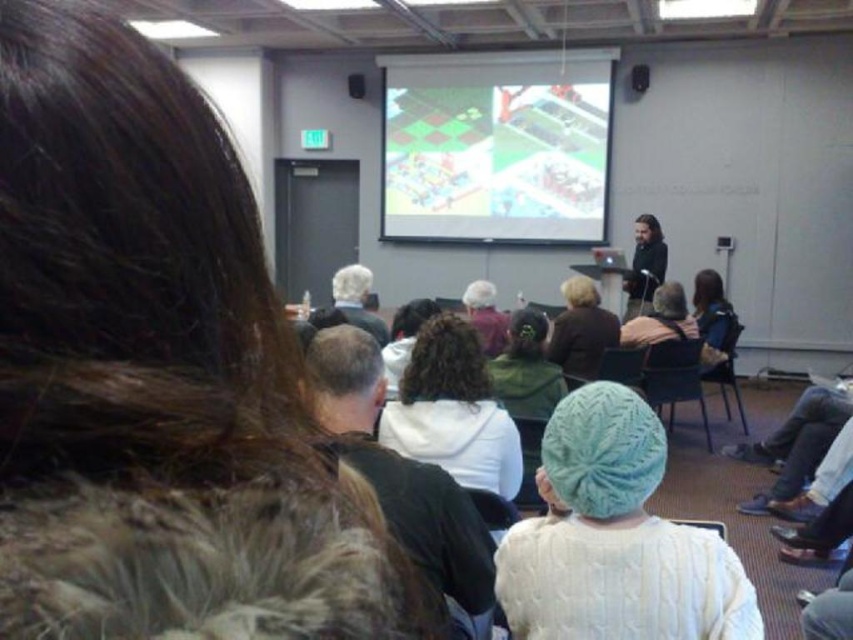
Question: Among these objects, which one is farthest from the camera?

Choices:
 (A) gray hair at center
 (B) white knitted hat at lower center
 (C) green fabric chair at center

Answer: (C)

Question: Can you confirm if green fabric chair at center is wider than curly hair at center?

Choices:
 (A) no
 (B) yes

Answer: (B)

Question: Is green fuzzy sweater at center above curly hair at center?

Choices:
 (A) no
 (B) yes

Answer: (A)

Question: Which object is farther from the camera taking this photo?

Choices:
 (A) white knitted hat at lower center
 (B) matte black laptop at center
 (C) white fleece jacket at center

Answer: (B)

Question: Which point appears farthest from the camera in this image?

Choices:
 (A) (636, 83)
 (B) (564, 371)
 (C) (677, 352)
 (D) (590, 584)

Answer: (A)

Question: Is white knit hat at center smaller than dark brown hair at center?

Choices:
 (A) yes
 (B) no

Answer: (B)